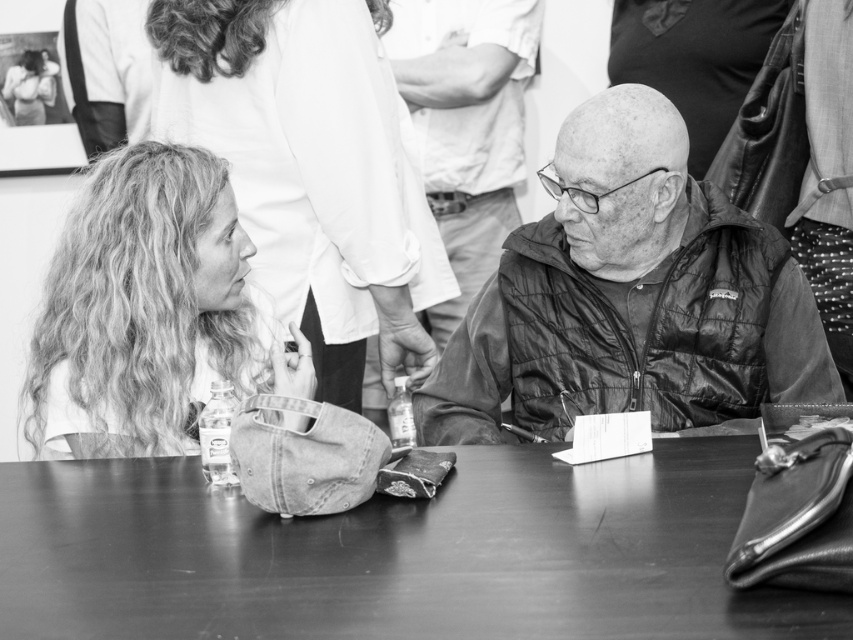
Who is shorter, smooth wood table at center or leather jacket at center?

With less height is smooth wood table at center.

Is smooth wood table at center wider than leather jacket at center?

Correct, the width of smooth wood table at center exceeds that of leather jacket at center.

Who is more distant from viewer, (109,467) or (502,129)?

Point (502,129)

Identify the location of smooth wood table at center. The image size is (853, 640). (396, 554).

Between point (833, 365) and point (483, 275), which one is positioned behind?

Positioned behind is point (483, 275).

Does point (645, 292) come behind point (416, 61)?

No, (645, 292) is closer to viewer.

Which is in front, point (587, 154) or point (500, 227)?

Point (587, 154)

Locate an element on the screen. quilted black jacket at center is located at coordinates (630, 298).

Looking at this image, who is positioned more to the right, quilted black jacket at center or curly hair at left?

quilted black jacket at center is more to the right.

Does point (503, 301) come closer to viewer compared to point (146, 278)?

No, it is not.

Find the location of a particular element. The image size is (853, 640). quilted black jacket at center is located at coordinates (630, 298).